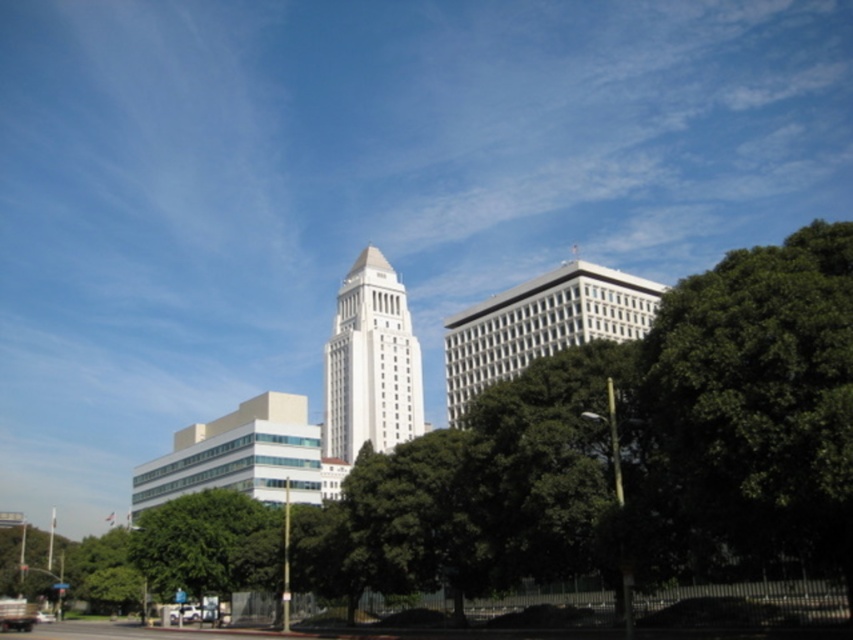
From the picture: You are a city planner evaluating the urban space between the green leafy tree at center and the white smooth tower at center. Which object occupies more space in this area?

The green leafy tree at center is larger in size than the white smooth tower at center, so it occupies more space in the area.

You are a bird looking for a high perch. You see the green leafy tree at center and the white smooth tower at center. Which one is taller?

The green leafy tree at center is taller than the white smooth tower at center, so the bird should choose the green leafy tree at center for a higher perch.